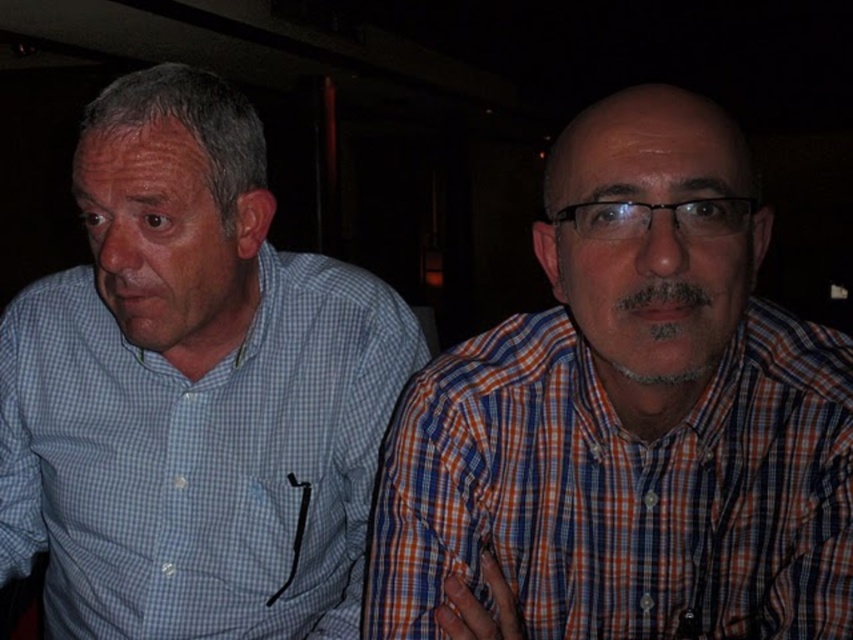
Question: Does blue checkered shirt at left have a lesser width compared to orange plaid shirt at right?

Choices:
 (A) yes
 (B) no

Answer: (B)

Question: Can you confirm if orange plaid shirt at right is positioned to the left of black plastic glasses at center?

Choices:
 (A) no
 (B) yes

Answer: (B)

Question: Which object is closer to the camera taking this photo?

Choices:
 (A) orange plaid shirt at right
 (B) black plastic glasses at center
 (C) blue checkered shirt at left

Answer: (B)

Question: Which object is the farthest from the black plastic glasses at center?

Choices:
 (A) orange plaid shirt at right
 (B) blue checkered shirt at left

Answer: (B)

Question: Does blue checkered shirt at left appear on the right side of orange plaid shirt at right?

Choices:
 (A) yes
 (B) no

Answer: (B)

Question: Which of the following is the closest to the observer?

Choices:
 (A) (726, 208)
 (B) (780, 392)

Answer: (A)